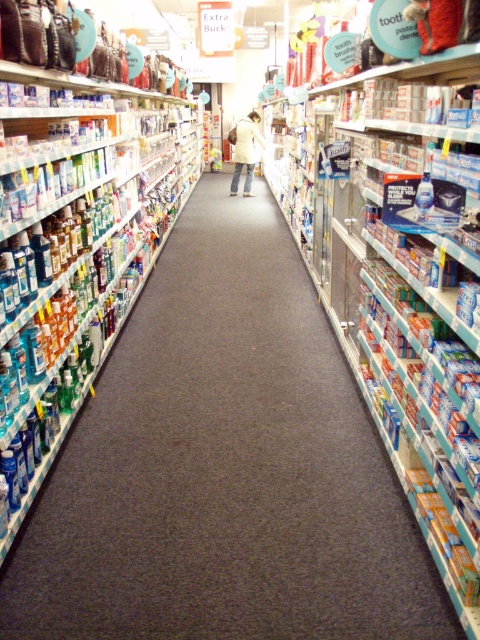
Question: Which point is farther from the camera taking this photo?

Choices:
 (A) (119, 177)
 (B) (203, 280)
 (C) (323, 116)
 (D) (247, 140)

Answer: (D)

Question: Is clear plastic bottles at center to the right of blue plastic toothpaste at center from the viewer's perspective?

Choices:
 (A) yes
 (B) no

Answer: (B)

Question: Is blue plastic toothpaste at center to the right of clear plastic bottles at left from the viewer's perspective?

Choices:
 (A) no
 (B) yes

Answer: (B)

Question: Estimate the real-world distances between objects in this image. Which object is closer to the blue plastic toothpaste at center?

Choices:
 (A) clear plastic bottles at center
 (B) clear plastic bottles at left
 (C) white matte coat at center

Answer: (A)

Question: Does clear plastic bottles at center have a greater width compared to blue plastic toothpaste at center?

Choices:
 (A) no
 (B) yes

Answer: (B)

Question: Which point is farther to the camera?

Choices:
 (A) (196, 465)
 (B) (113, 285)
 (C) (379, 129)
 (D) (237, 148)

Answer: (D)